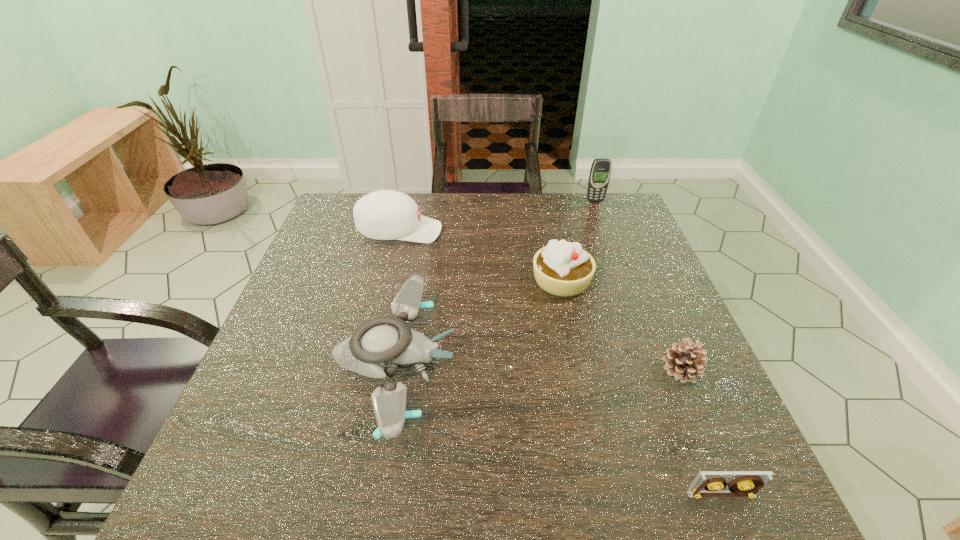
At what (x,y) coordinates should I click in order to perform the action: click on object that is at the far right corner. Please return your answer as a coordinate pair (x, y). Looking at the image, I should click on (600, 171).

Where is `object that is at the near right corner`? This screenshot has width=960, height=540. object that is at the near right corner is located at coordinates (745, 483).

You are a GUI agent. You are given a task and a screenshot of the screen. Output one action in this format:
    pyautogui.click(x=<x>, y=<y>)
    Task: Click on the vacant area at the far edge
    This screenshot has height=540, width=960.
    Given the screenshot: What is the action you would take?
    pyautogui.click(x=462, y=225)

I want to click on free space at the left edge of the desktop, so click(284, 321).

In the image, there is a desktop. Identify the location of free space at the right edge. (682, 327).

The image size is (960, 540). Identify the location of free space at the far left corner of the desktop. (347, 226).

Locate an element on the screen. The image size is (960, 540). free location at the near left corner of the desktop is located at coordinates (211, 491).

The width and height of the screenshot is (960, 540). What are the coordinates of `vacant space at the far right corner` in the screenshot? It's located at pos(587,212).

I want to click on vacant space in between the nearest object and the whipped cream, so click(641, 388).

Find the location of a particular element. The image size is (960, 540). vacant area that lies between the second farthest object and the third object from left to right is located at coordinates (481, 256).